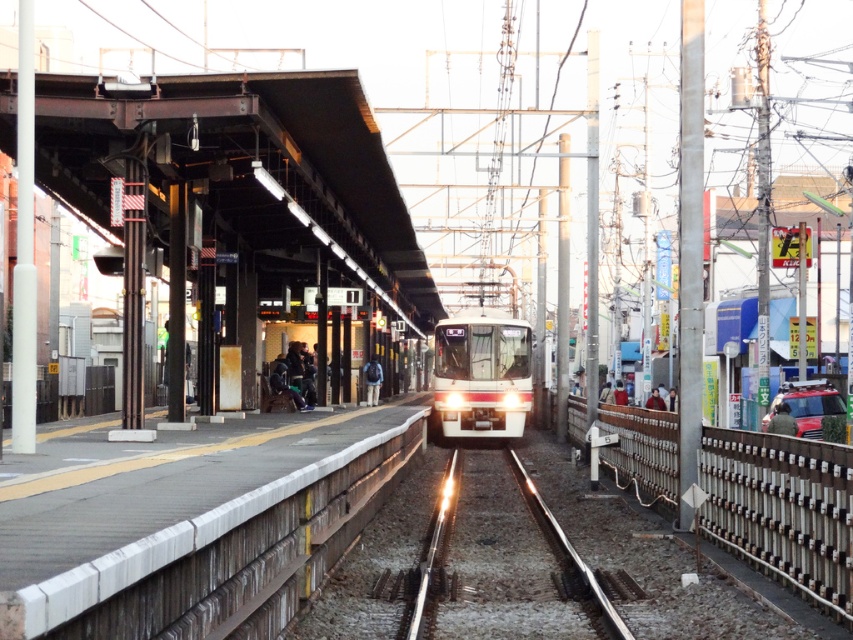
Question: Among these points, which one is farthest from the camera?

Choices:
 (A) (840, 448)
 (B) (366, 384)
 (C) (476, 346)
 (D) (387, 492)

Answer: (B)

Question: Which point appears farthest from the camera in this image?

Choices:
 (A) (509, 396)
 (B) (375, 384)

Answer: (B)

Question: Does white glossy train at center have a larger size compared to dark blue backpack at center?

Choices:
 (A) no
 (B) yes

Answer: (A)

Question: Can you confirm if concrete platform at center is wider than dark blue backpack at center?

Choices:
 (A) yes
 (B) no

Answer: (A)

Question: Which object is the closest to the dark blue backpack at center?

Choices:
 (A) white glossy train at center
 (B) metallic silver train track at center

Answer: (A)

Question: Does concrete platform at center appear over white metal fence at right?

Choices:
 (A) yes
 (B) no

Answer: (A)